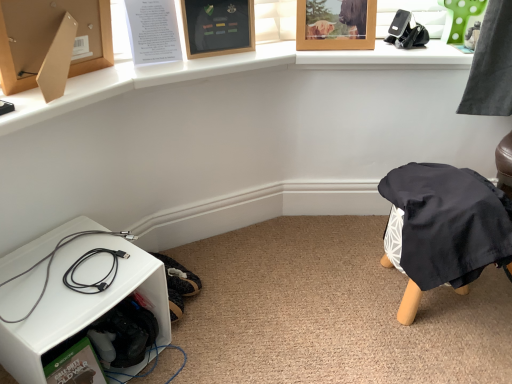
You are a GUI agent. You are given a task and a screenshot of the screen. Output one action in this format:
    pyautogui.click(x=<x>, y=<y>)
    Task: Click on the vacant region under black cable at lower left (from a real-world perspective)
    The width and height of the screenshot is (512, 384).
    Given the screenshot: What is the action you would take?
    pyautogui.click(x=61, y=277)